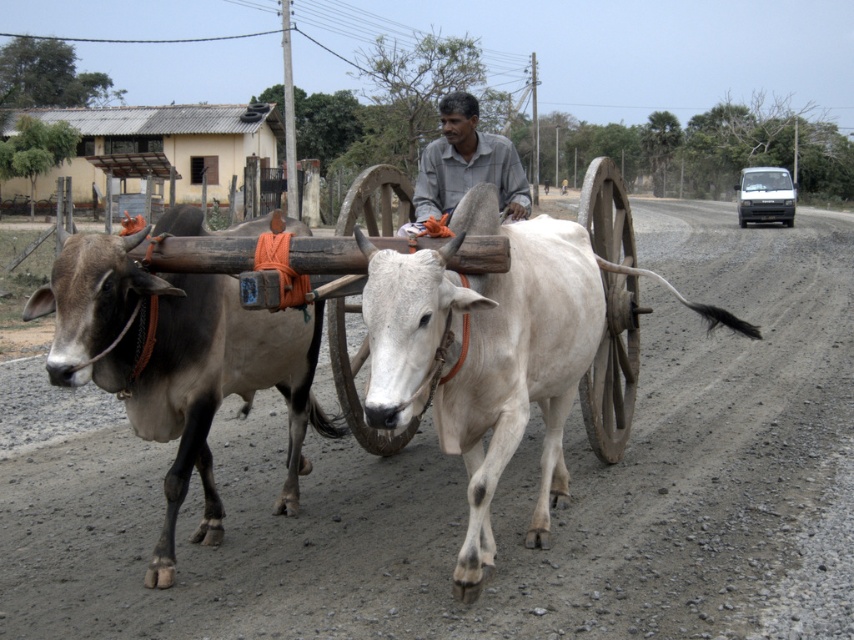
Can you confirm if gray gravel road at center is thinner than brown leather bull at center?

No.

Image resolution: width=854 pixels, height=640 pixels. I want to click on gray gravel road at center, so click(496, 488).

Between brown leather bull at center and wooden cart at center, which one has less height?

Standing shorter between the two is brown leather bull at center.

Is point (291, 403) positioned after point (597, 216)?

No.

In order to click on brown leather bull at center in this screenshot , I will do `click(178, 364)`.

Between brown leather bull at center and light gray shirt at center, which one is positioned lower?

brown leather bull at center

Is brown leather bull at center positioned in front of light gray shirt at center?

Result: Yes, brown leather bull at center is closer to the viewer.

The height and width of the screenshot is (640, 854). What do you see at coordinates (178, 364) in the screenshot? I see `brown leather bull at center` at bounding box center [178, 364].

At what (x,y) coordinates should I click in order to perform the action: click on brown leather bull at center. Please return your answer as a coordinate pair (x, y). The image size is (854, 640). Looking at the image, I should click on (178, 364).